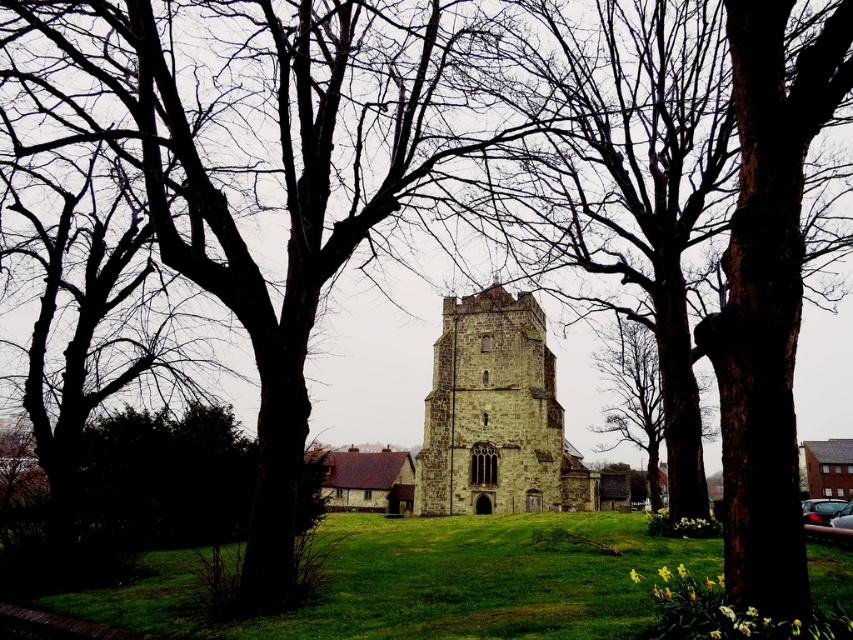
You are standing in the grassy area in front of the historic stone church. You want to walk towards the stone tower at center. Which direction should you walk relative to the green grassy field at center?

You should walk towards the stone tower at center, which is behind the green grassy field at center. Since the green grassy field at center is in front of the stone tower at center, you need to move backward or away from the green grassy field at center to reach the stone tower at center.

Looking at this image, you are standing at the point labeled point (483, 579) in the image. What is the name of the area you are currently standing on?

The point (483, 579) corresponds to the green grassy field at center, so you are standing on the green grassy field at center.